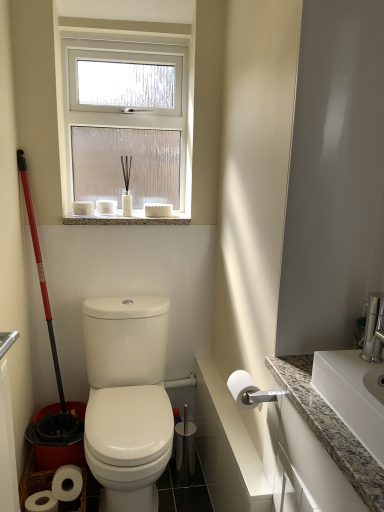
Question: From the image's perspective, is white glossy toilet at center above or below granite at upper center?

Choices:
 (A) above
 (B) below

Answer: (B)

Question: Which is correct: white glossy toilet at center is inside granite at upper center, or outside of it?

Choices:
 (A) inside
 (B) outside

Answer: (B)

Question: Which is farther from the white matte toilet paper at right, acting as the 3th toilet paper starting from the top?

Choices:
 (A) granite countertop at right
 (B) clear glass window at upper center
 (C) white matte toilet paper at upper center, the second toilet paper in the bottom-to-top sequence
 (D) white glossy toilet at center
 (E) granite at upper center

Answer: (B)

Question: Which object is positioned farthest from the white granite sink at right?

Choices:
 (A) granite at upper center
 (B) white matte toilet paper at right, which ranks as the 1th toilet paper in front-to-back order
 (C) granite countertop at right
 (D) white matte toilet paper at upper center, the second toilet paper in the bottom-to-top sequence
 (E) white matte toilet paper at upper center, the 1th toilet paper in the left-to-right sequence

Answer: (E)